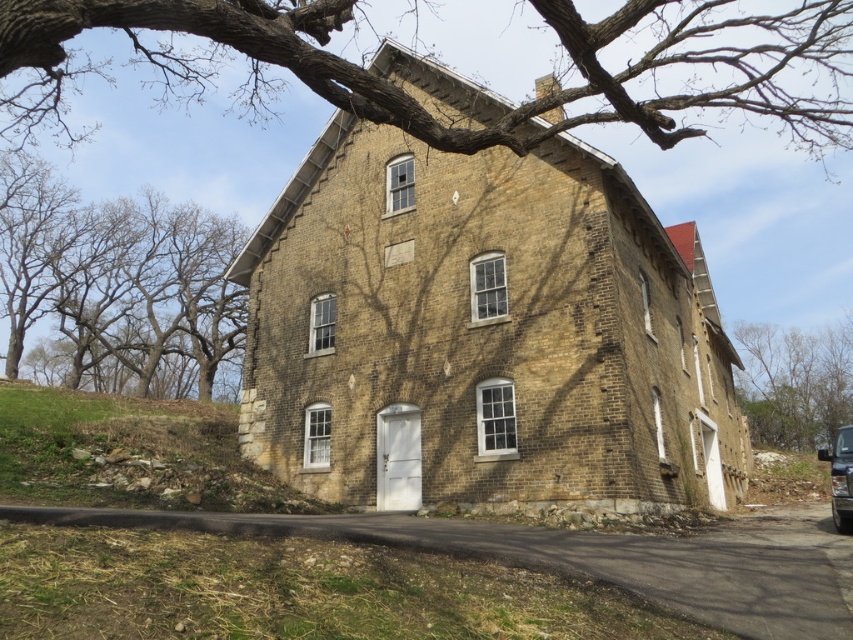
Question: Can you confirm if bare branches at right is smaller than metallic silver car at lower right?

Choices:
 (A) no
 (B) yes

Answer: (B)

Question: Can you confirm if brown bark tree at upper center is wider than metallic silver car at lower right?

Choices:
 (A) no
 (B) yes

Answer: (B)

Question: Which object is positioned farthest from the metallic silver car at lower right?

Choices:
 (A) bare branches at left
 (B) bare branches at right
 (C) brown bark tree at upper center

Answer: (A)

Question: Which point is closer to the camera?

Choices:
 (A) (657, 61)
 (B) (178, 211)
 (C) (846, 532)

Answer: (A)

Question: Is brown bark tree at upper center behind metallic silver car at lower right?

Choices:
 (A) no
 (B) yes

Answer: (A)

Question: Among these points, which one is nearest to the camera?

Choices:
 (A) (775, 88)
 (B) (846, 518)
 (C) (9, 278)
 (D) (807, 390)

Answer: (B)